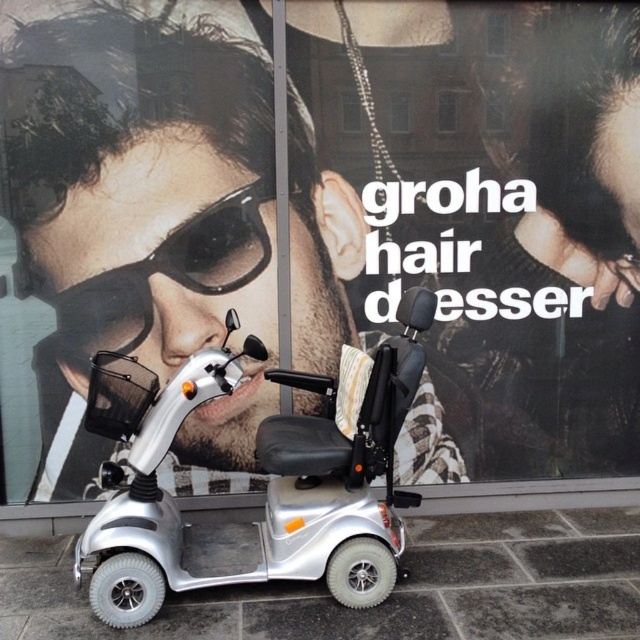
Question: In this image, where is silver metallic mobility scooter at center located relative to matte black goggles at center?

Choices:
 (A) left
 (B) right

Answer: (B)

Question: Can you confirm if silver metallic mobility scooter at center is positioned to the left of matte black goggles at center?

Choices:
 (A) yes
 (B) no

Answer: (B)

Question: Among these points, which one is farthest from the camera?

Choices:
 (A) (104, 476)
 (B) (132, 321)

Answer: (B)

Question: Can you confirm if silver metallic mobility scooter at center is bigger than matte black goggles at center?

Choices:
 (A) no
 (B) yes

Answer: (B)

Question: Which point appears closest to the camera in this image?

Choices:
 (A) (301, 556)
 (B) (172, 275)

Answer: (A)